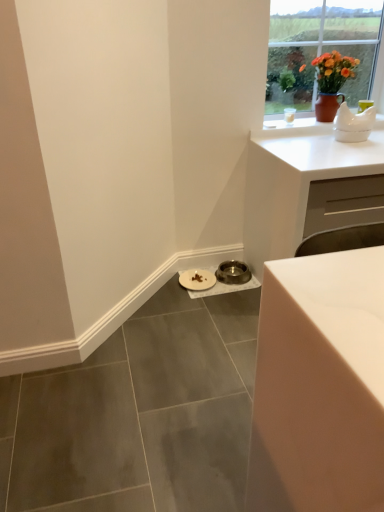
Question: From a real-world perspective, is metallic silver bowl at lower center, which is counted as the first manhole cover, starting from the right, positioned above or below white matte plate at lower center, which is counted as the 1th manhole cover, starting from the left?

Choices:
 (A) below
 (B) above

Answer: (A)

Question: Is metallic silver bowl at lower center, which is counted as the first manhole cover, starting from the right, taller or shorter than white matte plate at lower center, which is the 2th manhole cover in right-to-left order?

Choices:
 (A) tall
 (B) short

Answer: (A)

Question: Estimate the real-world distances between objects in this image. Which object is closer to the white matte plate at lower center, which is the 2th manhole cover in right-to-left order?

Choices:
 (A) white ceramic teapot at upper right
 (B) white matte cabinet at upper right
 (C) metallic silver bowl at lower center, which is counted as the first manhole cover, starting from the right
 (D) matte brown vase at upper right
 (E) white glossy table at lower right

Answer: (C)

Question: Which object is the farthest from the white matte plate at lower center, which is counted as the 1th manhole cover, starting from the left?

Choices:
 (A) white glossy table at lower right
 (B) matte brown vase at upper right
 (C) white matte cabinet at upper right
 (D) white ceramic teapot at upper right
 (E) metallic silver bowl at lower center, the second manhole cover in the left-to-right sequence

Answer: (A)